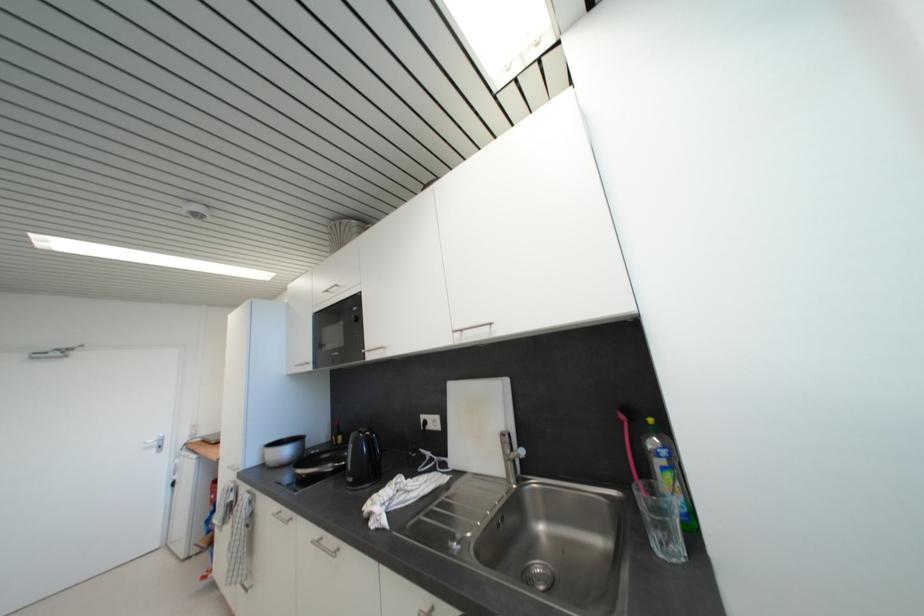
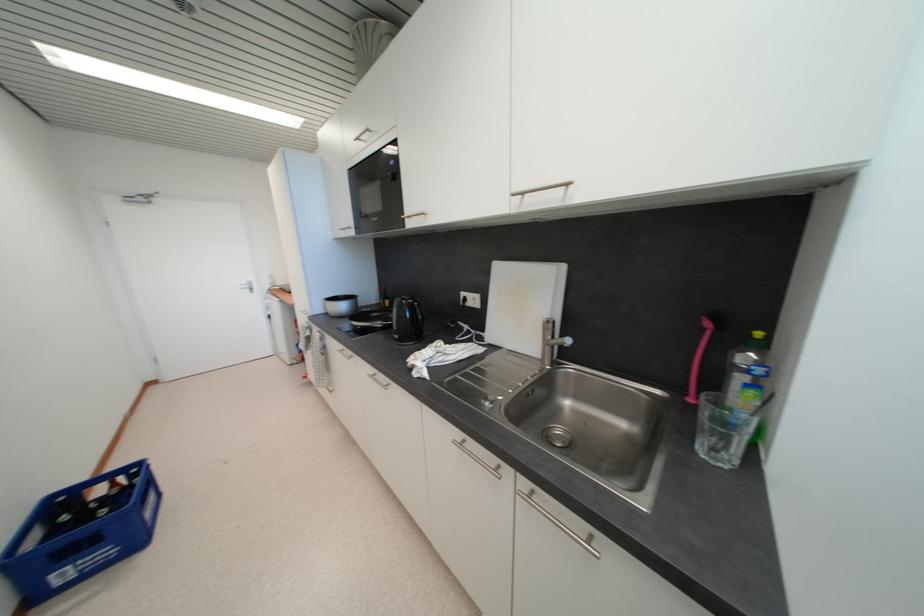
The point at (318,544) is marked in the first image. Where is the corresponding point in the second image?

(373, 378)